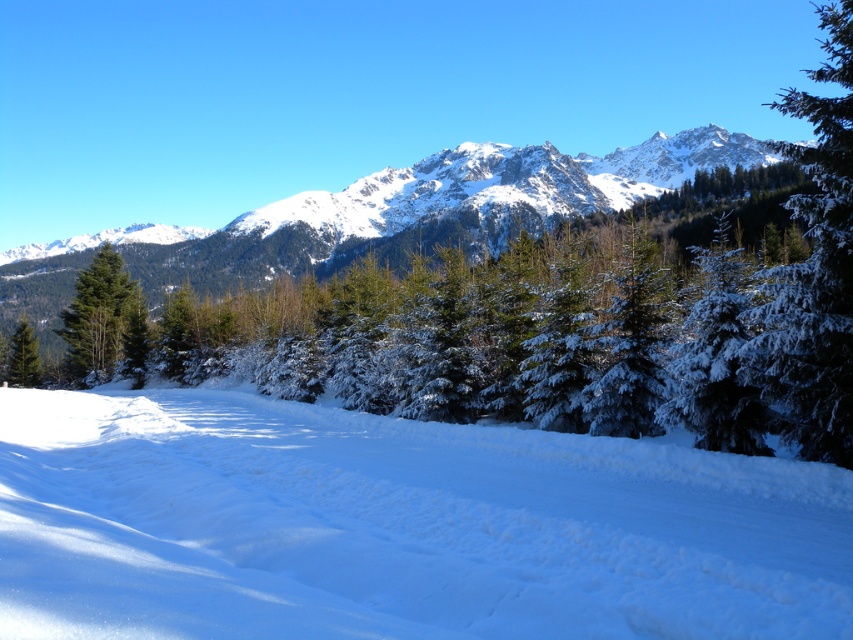
You are a hiker planning to cross the snowfield. You see the white snow at lower center and the green matte tree at left. Which direction should you head to move from the tree towards the snow area?

To move from the green matte tree at left towards the white snow at lower center, you should head to the right since the white snow at lower center is located to the right of the green matte tree at left.

You are an outdoor enthusiast planning to hike from the white snow at lower center to the snowy rocky mountain at upper center. Based on the scene description, which direction should you head to reach the mountain?

The snowy rocky mountain at upper center is taller than the white snow at lower center, so you should head upwards or towards the upper part of the image to reach the mountain.

You are an observer standing at the edge of the snowfield. You notice the white snow at lower center and the green matte tree at left. Which object appears closer to you in the scene?

The white snow at lower center appears closer to you because it has a smaller size compared to the green matte tree at left, indicating it is nearer in the scene.